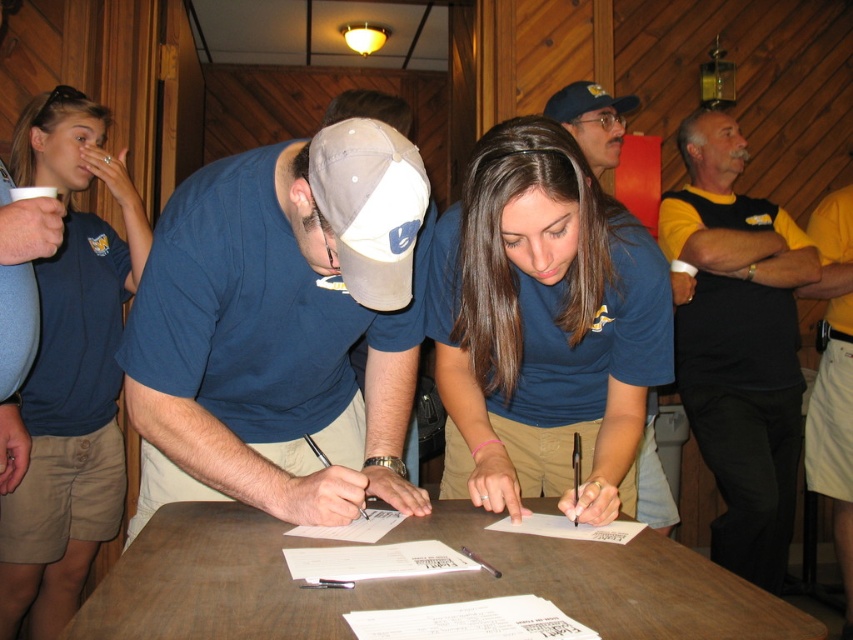
Question: Which object appears closest to the camera in this image?

Choices:
 (A) matte blue cap at center
 (B) gray fabric baseball cap at center

Answer: (B)

Question: Is blue fabric shirt at center further to the viewer compared to matte blue cap at center?

Choices:
 (A) no
 (B) yes

Answer: (A)

Question: Is blue fabric shirt at center smaller than matte blue cap at center?

Choices:
 (A) no
 (B) yes

Answer: (A)

Question: Among these objects, which one is nearest to the camera?

Choices:
 (A) white paper at center
 (B) brown wooden table at center
 (C) gray fabric baseball cap at center

Answer: (B)

Question: Among these points, which one is nearest to the camera?

Choices:
 (A) (614, 104)
 (B) (592, 88)

Answer: (B)

Question: Can you confirm if gray fabric baseball cap at center is thinner than matte blue cap at center?

Choices:
 (A) no
 (B) yes

Answer: (B)